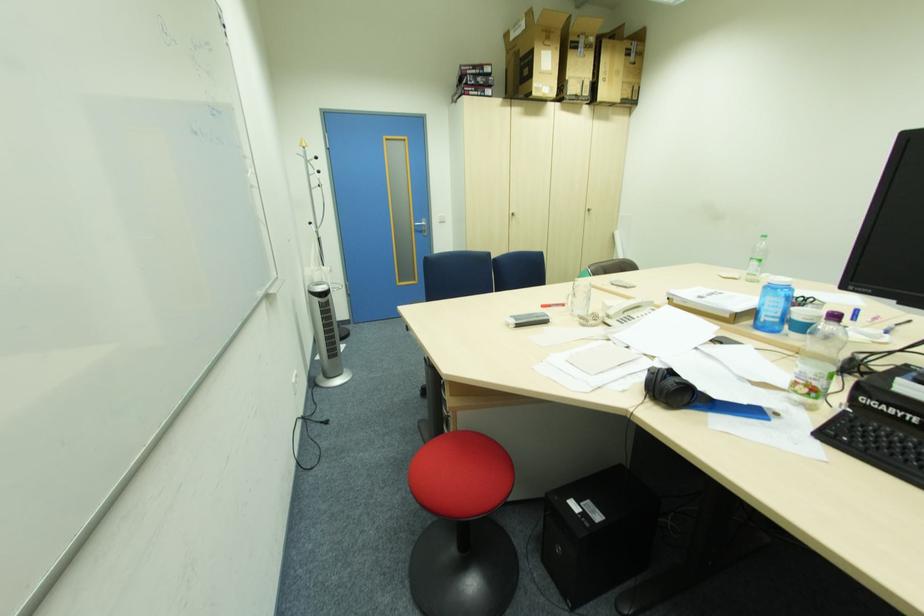
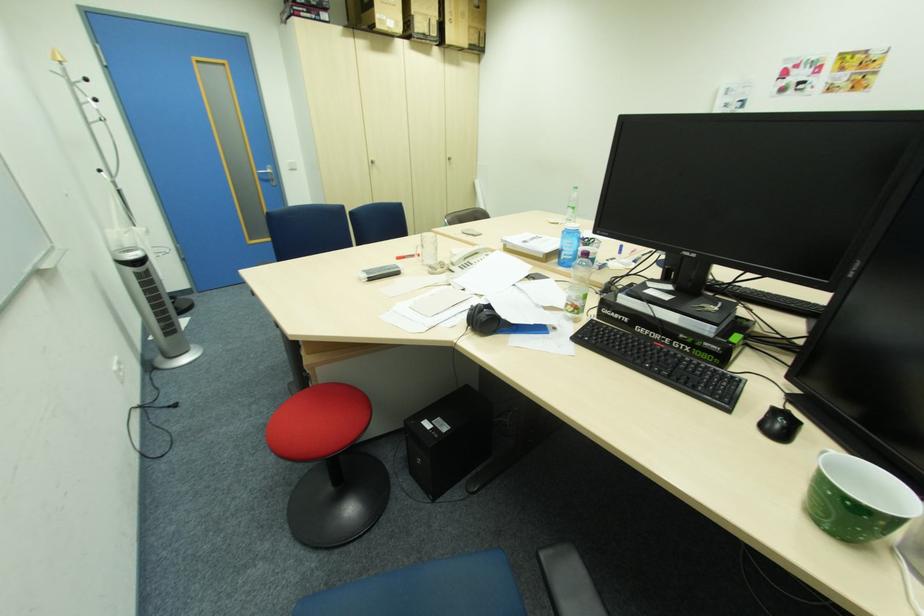
Find the pixel in the second image that matches (x=419, y=227) in the first image.

(264, 174)